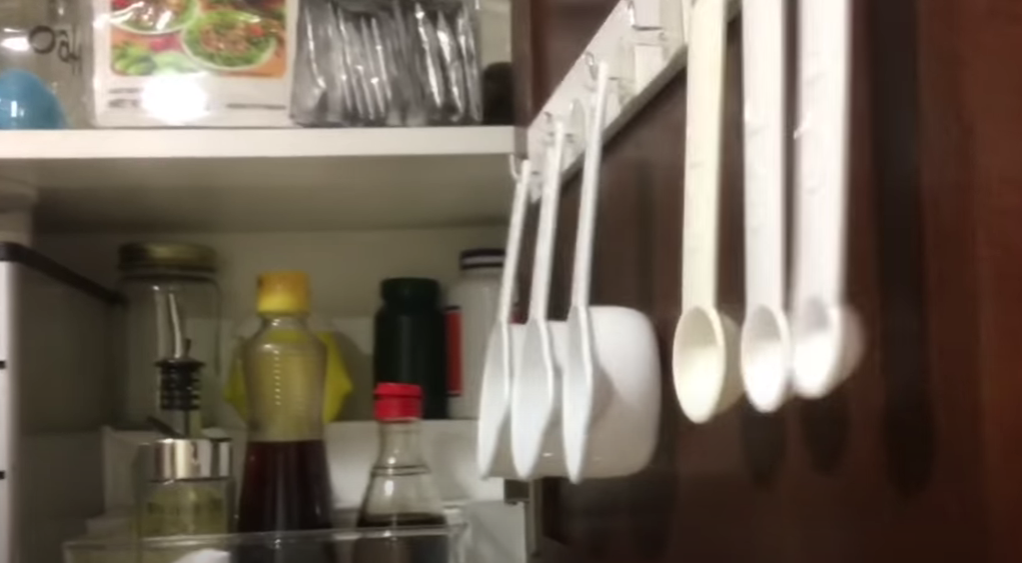
Where is `white measuring spoons`? The width and height of the screenshot is (1022, 563). white measuring spoons is located at coordinates (824, 341), (771, 342), (689, 348).